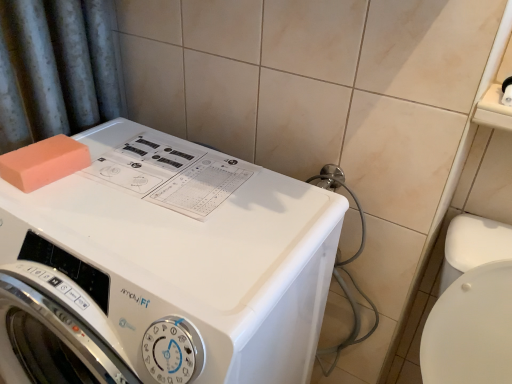
Locate an element on the screen. unoccupied region to the right of orange matte sponge at top left is located at coordinates (130, 175).